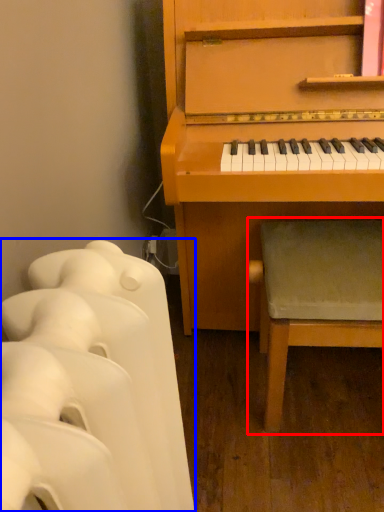
Question: Which of the following is the farthest to the observer, music stool (highlighted by a red box) or furniture (highlighted by a blue box)?

Choices:
 (A) music stool
 (B) furniture

Answer: (A)